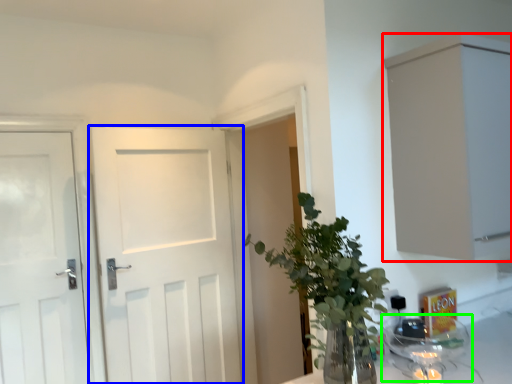
Question: Based on their relative distances, which object is nearer to cabinetry (highlighted by a red box)? Choose from door (highlighted by a blue box) and glass jar (highlighted by a green box).

Choices:
 (A) door
 (B) glass jar

Answer: (B)